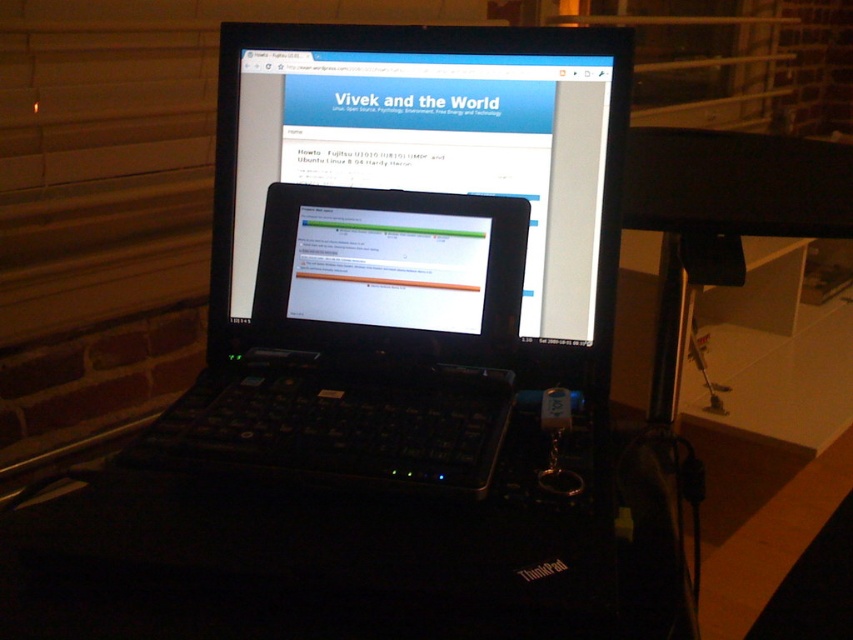
Looking at this image, you are a photographer standing at a distance of 24 inches from the black plastic laptop at center. You want to take a photo of it. Can you move closer to get a better shot without exceeding the minimum safe distance recommended for handling electronic devices?

The black plastic laptop at center is currently 23.75 inches away from the camera. Since you are standing at 24 inches, which is slightly farther away, you can move closer by 0.25 inches to reach the exact minimum safe distance. However, moving closer than 23.75 inches would be unsafe and not recommended.

Where is the black plastic laptop at center located in the image?

The black plastic laptop at center is located at point (433,150) in the image.

Looking at this image, you are organizing a tech event and need to display two laptops on a table. You have a black plastic laptop at center and a matte black laptop at center. If you want to arrange them side by side with the larger one on the left, which laptop should be placed on the left side?

The black plastic laptop at center should be placed on the left side because it is larger than the matte black laptop at center according to the description.